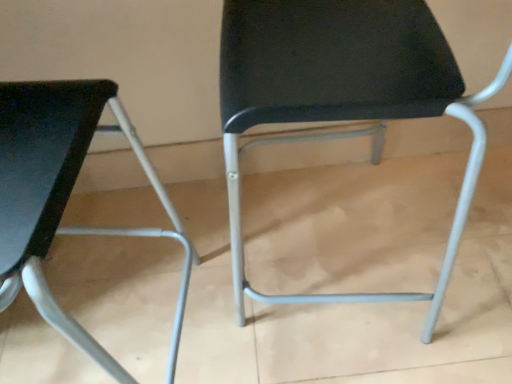
This screenshot has width=512, height=384. Find the location of `spots to the right of black fabric chair at center, the 1th chair from the right`. spots to the right of black fabric chair at center, the 1th chair from the right is located at coordinates (460, 234).